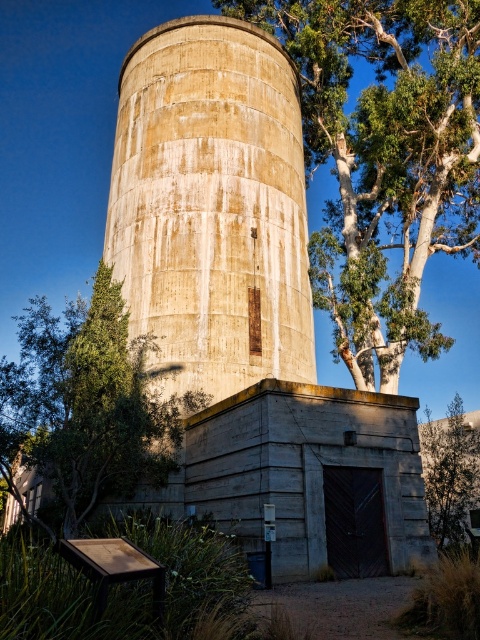
Question: Estimate the real-world distances between objects in this image. Which object is closer to the green leafy tree at lower right?

Choices:
 (A) green leafy tree at center
 (B) green leafy tree at lower left

Answer: (A)

Question: Estimate the real-world distances between objects in this image. Which object is closer to the green leafy tree at center?

Choices:
 (A) green leafy tree at lower right
 (B) green leafy tree at lower left

Answer: (B)

Question: Is green leafy tree at center positioned at the back of green leafy tree at lower left?

Choices:
 (A) no
 (B) yes

Answer: (B)

Question: Among these points, which one is farthest from the camera?

Choices:
 (A) (429, 452)
 (B) (439, 220)
 (C) (108, 204)

Answer: (C)

Question: From the image, what is the correct spatial relationship of green leafy tree at center in relation to green leafy tree at lower left?

Choices:
 (A) below
 (B) above

Answer: (B)

Question: Can you confirm if green leafy tree at lower left is positioned to the left of green leafy tree at lower right?

Choices:
 (A) no
 (B) yes

Answer: (B)